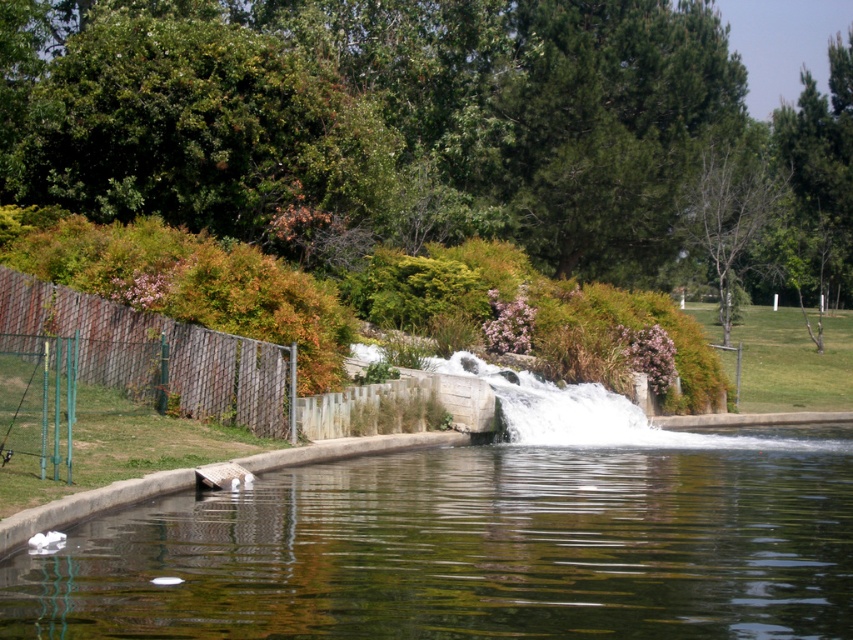
You are planning to cross the brown mesh fence at left to reach the clear water at center. Considering their widths, which one is wider?

The clear water at center is wider than the brown mesh fence at left, so you can cross the fence to reach the water since it is narrower than the water.

You are standing at the edge of the brown mesh fence at left and want to reach the clear water at center. Which direction should you move to get there?

You should move to the right, as the clear water at center is to the right of the brown mesh fence at left.

You are standing in the outdoor scene and want to take a photo of the clear water at center. The brown mesh fence at left might block your view. Based on their positions, can you tell if the fence will block the water in your photo?

The clear water at center is closer to the viewer than the brown mesh fence at left, so the fence will not block the view of the water in your photo.